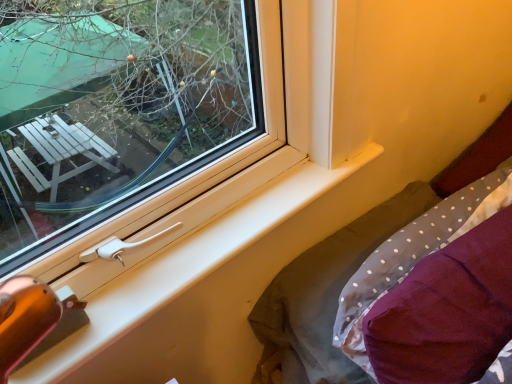
This screenshot has width=512, height=384. Describe the element at coordinates (353, 271) in the screenshot. I see `gray polka dot fabric at lower right` at that location.

What do you see at coordinates (447, 311) in the screenshot?
I see `maroon fabric pillow at lower right` at bounding box center [447, 311].

Identify the location of white plastic window sill at lower left. This screenshot has height=384, width=512. (186, 265).

Considering the positions of objects white plastic window sill at lower left and gray polka dot fabric at lower right in the image provided, who is more to the right, white plastic window sill at lower left or gray polka dot fabric at lower right?

gray polka dot fabric at lower right is more to the right.

From the image's perspective, is white plastic window sill at lower left positioned above or below gray polka dot fabric at lower right?

Clearly, from the image's perspective, white plastic window sill at lower left is above gray polka dot fabric at lower right.

Does white plastic window sill at lower left come in front of gray polka dot fabric at lower right?

Yes, white plastic window sill at lower left is closer to the viewer.

Between point (60, 343) and point (272, 369), which one is positioned behind?

The point (272, 369) is farther from the camera.

Does maroon fabric pillow at lower right have a larger size compared to gray polka dot fabric at lower right?

Actually, maroon fabric pillow at lower right might be smaller than gray polka dot fabric at lower right.

Where is `bed behind the maroon fabric pillow at lower right`? The image size is (512, 384). bed behind the maroon fabric pillow at lower right is located at coordinates (353, 271).

Considering the positions of point (511, 280) and point (426, 185), is point (511, 280) closer or farther from the camera than point (426, 185)?

Point (511, 280) is positioned closer to the camera compared to point (426, 185).

Considering their positions, is maroon fabric pillow at lower right located in front of or behind gray polka dot fabric at lower right?

maroon fabric pillow at lower right is positioned closer to the viewer than gray polka dot fabric at lower right.

Is gray polka dot fabric at lower right positioned with its back to white plastic window sill at lower left?

gray polka dot fabric at lower right is not turned away from white plastic window sill at lower left.

Based on their sizes in the image, would you say gray polka dot fabric at lower right is bigger or smaller than white plastic window sill at lower left?

Considering their sizes, gray polka dot fabric at lower right takes up more space than white plastic window sill at lower left.

Which is more to the left, gray polka dot fabric at lower right or white plastic window sill at lower left?

Positioned to the left is white plastic window sill at lower left.

Does gray polka dot fabric at lower right have a greater height compared to white plastic window sill at lower left?

Yes, gray polka dot fabric at lower right is taller than white plastic window sill at lower left.

Measure the distance between white plastic window sill at lower left and maroon fabric pillow at lower right.

A distance of 13.26 inches exists between white plastic window sill at lower left and maroon fabric pillow at lower right.

Is white plastic window sill at lower left positioned far away from maroon fabric pillow at lower right?

They are positioned close to each other.

Is white plastic window sill at lower left spatially inside maroon fabric pillow at lower right, or outside of it?

white plastic window sill at lower left is spatially situated outside maroon fabric pillow at lower right.

In the scene shown: Who is taller, white plastic window sill at lower left or maroon fabric pillow at lower right?

With more height is maroon fabric pillow at lower right.

Locate an element on the screen. The height and width of the screenshot is (384, 512). pillow positioned vertically above the gray polka dot fabric at lower right (from a real-world perspective) is located at coordinates (447, 311).

Is the depth of gray polka dot fabric at lower right greater than that of maroon fabric pillow at lower right?

That is True.

Is point (295, 364) positioned behind point (488, 347)?

Yes, point (295, 364) is farther from viewer.

Which of these two, gray polka dot fabric at lower right or maroon fabric pillow at lower right, is smaller?

With smaller size is maroon fabric pillow at lower right.

Considering the sizes of objects maroon fabric pillow at lower right and white plastic window sill at lower left in the image provided, who is smaller, maroon fabric pillow at lower right or white plastic window sill at lower left?

Smaller between the two is white plastic window sill at lower left.

Which is closer to the camera, (x=479, y=228) or (x=37, y=377)?

Point (x=479, y=228) is farther from the camera than point (x=37, y=377).

Is white plastic window sill at lower left at the back of maroon fabric pillow at lower right?

Absolutely, maroon fabric pillow at lower right is directed away from white plastic window sill at lower left.

Between maroon fabric pillow at lower right and white plastic window sill at lower left, which one has more height?

maroon fabric pillow at lower right is taller.

This screenshot has width=512, height=384. Find the location of `window sill in front of the gray polka dot fabric at lower right`. window sill in front of the gray polka dot fabric at lower right is located at coordinates (186, 265).

This screenshot has width=512, height=384. I want to click on bed that appears on the left of maroon fabric pillow at lower right, so click(x=353, y=271).

When comparing their distances from gray polka dot fabric at lower right, does white plastic window sill at lower left or maroon fabric pillow at lower right seem closer?

Among the two, maroon fabric pillow at lower right is located nearer to gray polka dot fabric at lower right.

Based on their spatial positions, is maroon fabric pillow at lower right or white plastic window sill at lower left further from gray polka dot fabric at lower right?

Based on the image, white plastic window sill at lower left appears to be further to gray polka dot fabric at lower right.

In the scene shown: From the image, which object appears to be nearer to white plastic window sill at lower left, maroon fabric pillow at lower right or gray polka dot fabric at lower right?

gray polka dot fabric at lower right is positioned closer to the anchor white plastic window sill at lower left.

Based on their spatial positions, is gray polka dot fabric at lower right or maroon fabric pillow at lower right further from white plastic window sill at lower left?

maroon fabric pillow at lower right.

Estimate the real-world distances between objects in this image. Which object is further from maroon fabric pillow at lower right, gray polka dot fabric at lower right or white plastic window sill at lower left?

white plastic window sill at lower left.

Which object lies further to the anchor point maroon fabric pillow at lower right, white plastic window sill at lower left or gray polka dot fabric at lower right?

white plastic window sill at lower left lies further to maroon fabric pillow at lower right than the other object.

This screenshot has height=384, width=512. Find the location of `bed between white plastic window sill at lower left and maroon fabric pillow at lower right in the horizontal direction`. bed between white plastic window sill at lower left and maroon fabric pillow at lower right in the horizontal direction is located at coordinates (353, 271).